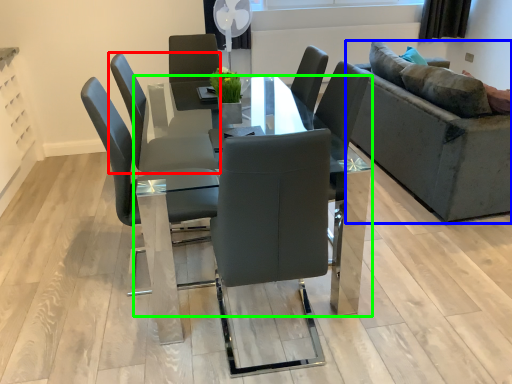
Question: Which object is positioned farthest from chair (highlighted by a red box)? Select from studio couch (highlighted by a blue box) and table (highlighted by a green box).

Choices:
 (A) studio couch
 (B) table

Answer: (A)